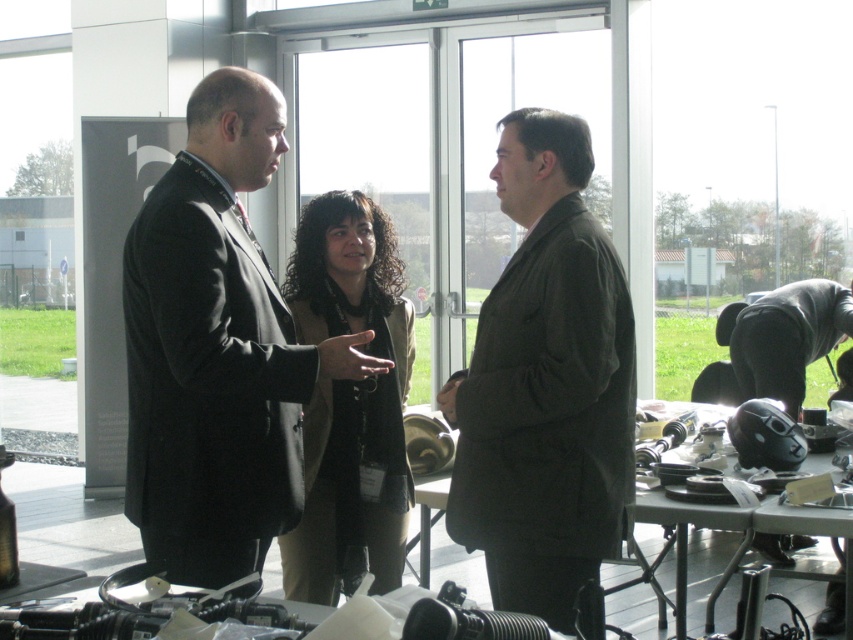
Question: Is dark brown suit at center to the right of dark brown textured blazer at center from the viewer's perspective?

Choices:
 (A) no
 (B) yes

Answer: (B)

Question: Which object is positioned closest to the black matte helmet at right?

Choices:
 (A) dark brown textured blazer at center
 (B) dark brown suit at center
 (C) matte black suit at center

Answer: (A)

Question: From the image, what is the correct spatial relationship of dark brown suit at center in relation to dark brown textured blazer at center?

Choices:
 (A) left
 (B) right

Answer: (B)

Question: Which of these objects is positioned farthest from the dark brown textured blazer at center?

Choices:
 (A) black matte helmet at right
 (B) dark brown suit at center

Answer: (A)

Question: Which of the following is the farthest from the observer?

Choices:
 (A) black matte helmet at right
 (B) matte black suit at center
 (C) dark brown textured blazer at center

Answer: (A)

Question: Is matte black suit at center below dark brown textured blazer at center?

Choices:
 (A) no
 (B) yes

Answer: (A)